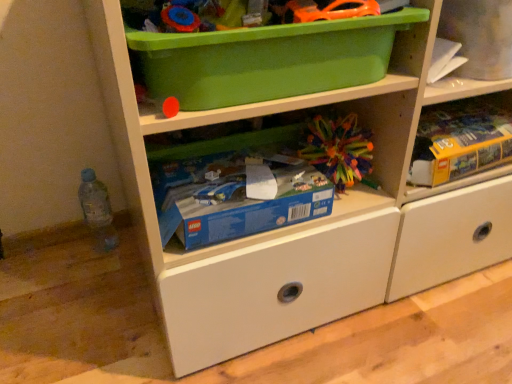
Identify the location of blank space situated above yellow cardboard box at upper right (from a real-world perspective). (455, 111).